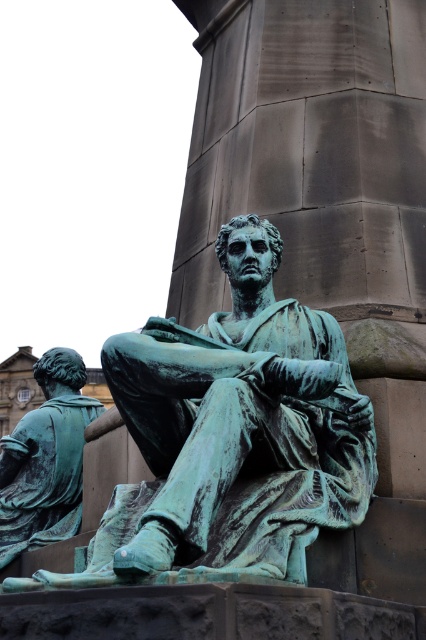
You are an art conservator examining the two green patina statues. Which statue is closer to you, the green patina statue at center or the green patina statue at lower left?

The green patina statue at center is closer to you because it is in front of the green patina statue at lower left.

From the picture: You are standing in front of the two bronze statues on the stone pedestal. You notice two points marked on the statues. The first point is at coordinate point (325, 516) and the second point is at coordinate point (5, 550). Which point is closer to you?

Point (325, 516) is in front of point (5, 550), so the first point is closer to you.